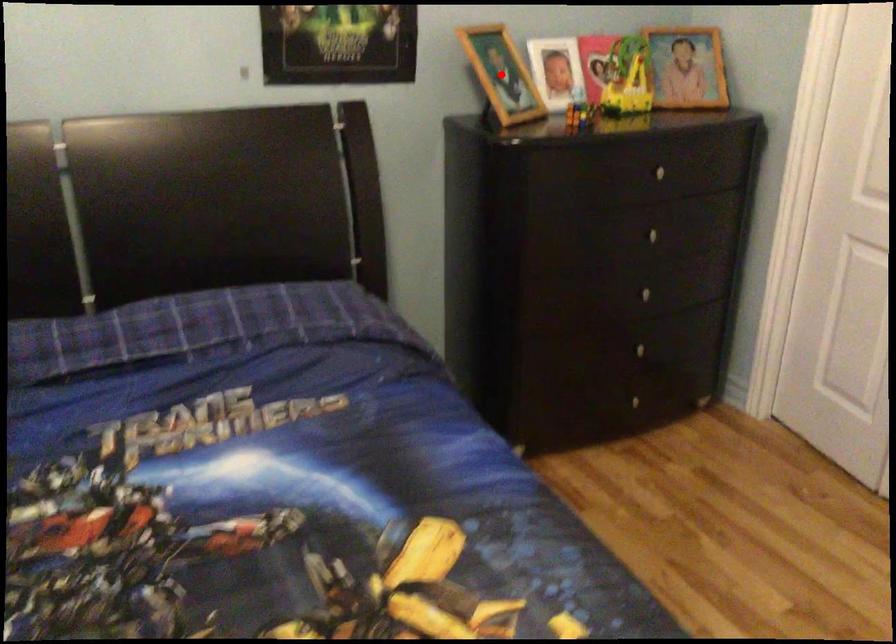
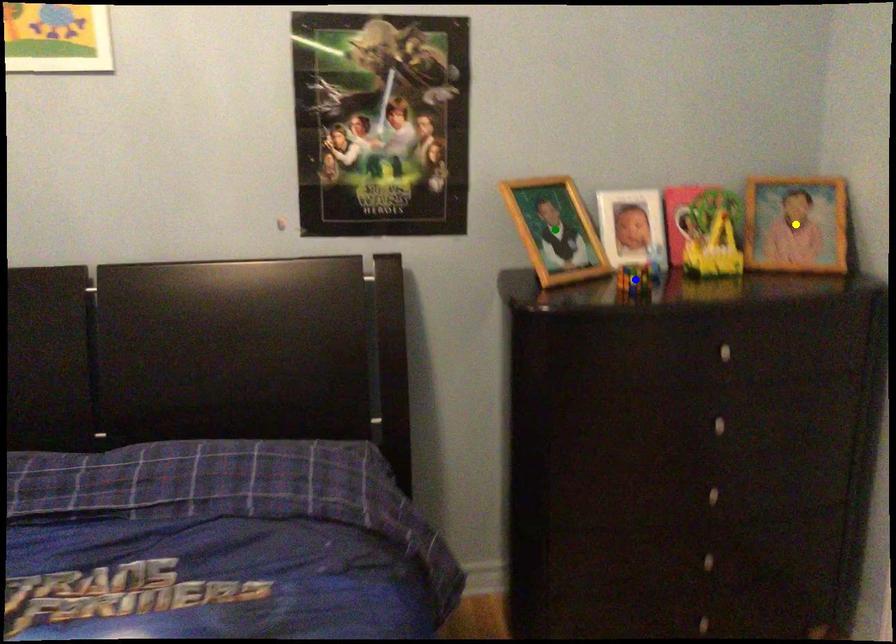
Question: I am providing you with two images of the same scene from different viewpoints. A red point is marked on the first image. You are given multiple points on the second image. Which mark in image 2 goes with the point in image 1?

Choices:
 (A) yellow point
 (B) blue point
 (C) green point

Answer: (C)